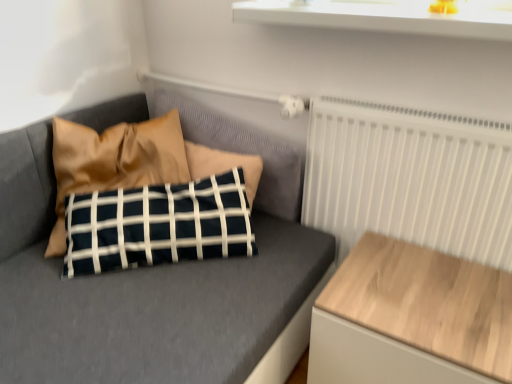
Question: Is white glossy window sill at upper center facing away from white matte radiator at upper right?

Choices:
 (A) no
 (B) yes

Answer: (A)

Question: Is white glossy window sill at upper center not near white matte radiator at upper right?

Choices:
 (A) no
 (B) yes

Answer: (A)

Question: From the image's perspective, does white glossy window sill at upper center appear lower than white matte radiator at upper right?

Choices:
 (A) yes
 (B) no

Answer: (B)

Question: Is white glossy window sill at upper center outside of white matte radiator at upper right?

Choices:
 (A) yes
 (B) no

Answer: (A)

Question: Considering the relative sizes of white glossy window sill at upper center and white matte radiator at upper right in the image provided, is white glossy window sill at upper center thinner than white matte radiator at upper right?

Choices:
 (A) yes
 (B) no

Answer: (B)

Question: Is white glossy window sill at upper center touching white matte radiator at upper right?

Choices:
 (A) no
 (B) yes

Answer: (A)

Question: From the image's perspective, is matte black pillow at center below satin brown pillow at upper left?

Choices:
 (A) yes
 (B) no

Answer: (A)

Question: Does matte black pillow at center have a lesser width compared to satin brown pillow at upper left?

Choices:
 (A) no
 (B) yes

Answer: (B)

Question: Is satin brown pillow at upper left at the back of matte black pillow at center?

Choices:
 (A) yes
 (B) no

Answer: (A)

Question: Considering the relative sizes of matte black pillow at center and satin brown pillow at upper left in the image provided, is matte black pillow at center wider than satin brown pillow at upper left?

Choices:
 (A) yes
 (B) no

Answer: (B)

Question: Are matte black pillow at center and satin brown pillow at upper left making contact?

Choices:
 (A) no
 (B) yes

Answer: (A)

Question: Considering the relative positions of matte black pillow at center and satin brown pillow at upper left in the image provided, is matte black pillow at center to the left of satin brown pillow at upper left from the viewer's perspective?

Choices:
 (A) yes
 (B) no

Answer: (B)

Question: Is white glossy window sill at upper center closer to the viewer compared to wooden table at right?

Choices:
 (A) yes
 (B) no

Answer: (B)